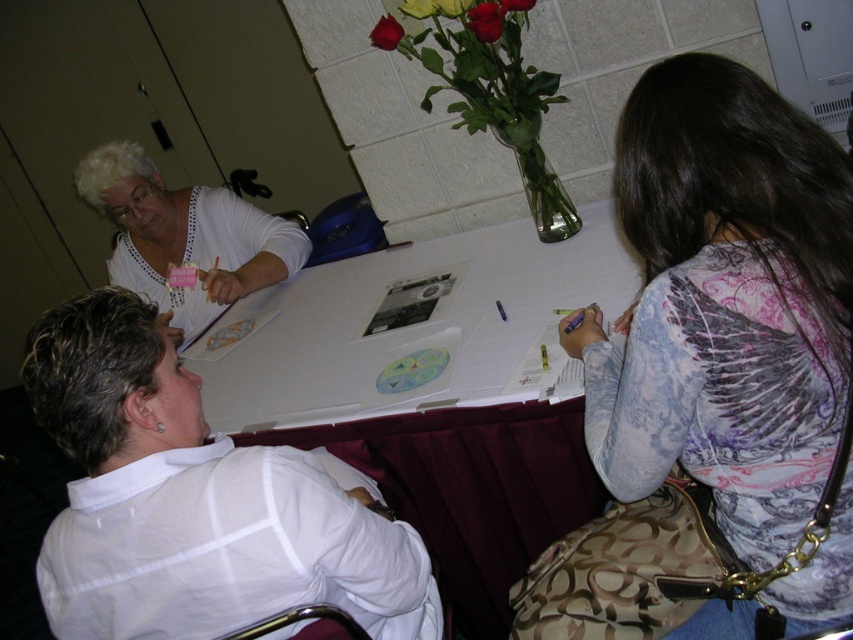
Can you confirm if white matte shirt at lower left is thinner than white dotted blouse at upper left?

Yes, white matte shirt at lower left is thinner than white dotted blouse at upper left.

Is white matte shirt at lower left wider than white dotted blouse at upper left?

No.

Is point (105, 548) behind point (112, 188)?

That is False.

The height and width of the screenshot is (640, 853). I want to click on white matte shirt at lower left, so click(196, 500).

Is the position of printed fabric shirt at right more distant than that of white paper at center?

No, printed fabric shirt at right is closer to the viewer.

Who is higher up, printed fabric shirt at right or white paper at center?

printed fabric shirt at right is higher up.

Locate an element on the screen. The image size is (853, 640). printed fabric shirt at right is located at coordinates (724, 301).

Is white paper at center below white dotted blouse at upper left?

Yes, white paper at center is below white dotted blouse at upper left.

Is white paper at center to the left of white dotted blouse at upper left from the viewer's perspective?

No, white paper at center is not to the left of white dotted blouse at upper left.

Between point (389, 442) and point (151, 225), which one is positioned behind?

Positioned behind is point (151, 225).

Image resolution: width=853 pixels, height=640 pixels. I want to click on white paper at center, so click(434, 385).